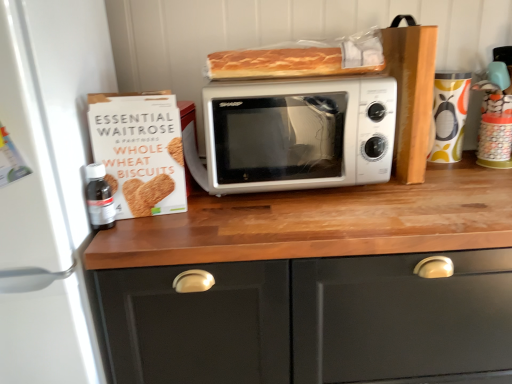
Question: From a real-world perspective, relative to matte ceramic mug at right, positioned as the 1th appliance in right-to-left order, is white matte microwave at center, which is the second appliance from right to left, vertically above or below?

Choices:
 (A) above
 (B) below

Answer: (B)

Question: From their relative heights in the image, would you say white matte microwave at center, marked as the 1th appliance in a left-to-right arrangement, is taller or shorter than matte ceramic mug at right, positioned as the 1th appliance in right-to-left order?

Choices:
 (A) tall
 (B) short

Answer: (A)

Question: Based on their relative distances, which object is nearer to the matte wood cabinet at center?

Choices:
 (A) white matte microwave at center, marked as the 1th appliance in a left-to-right arrangement
 (B) golden brown crusty loaf at upper center
 (C) white matte microwave at center
 (D) transparent plastic bottle at left
 (E) matte ceramic mug at right, positioned as the 1th appliance in right-to-left order

Answer: (C)

Question: Which object is positioned closest to the white matte microwave at center, which is the second appliance from right to left?

Choices:
 (A) transparent plastic bottle at left
 (B) matte wood cabinet at center
 (C) matte ceramic mug at right, positioned as the 1th appliance in right-to-left order
 (D) white matte microwave at center
 (E) white cardboard box at left

Answer: (E)